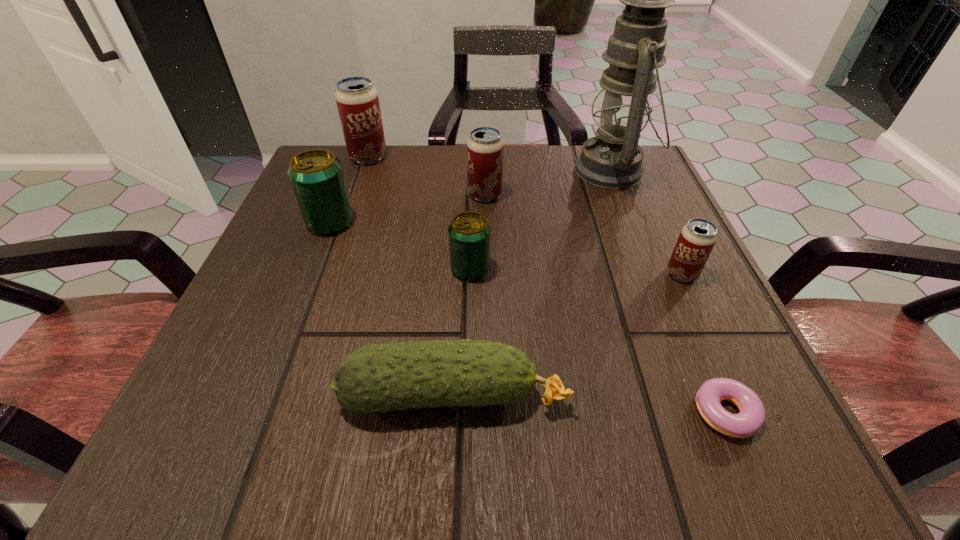
I want to click on oil lamp, so click(x=613, y=159).

Identify the location of the seventh shortest object. The width and height of the screenshot is (960, 540). (357, 100).

The image size is (960, 540). I want to click on the leftmost red beer can, so click(x=357, y=100).

The width and height of the screenshot is (960, 540). In order to click on the second farthest red beer can in this screenshot , I will do `click(485, 146)`.

You are a GUI agent. You are given a task and a screenshot of the screen. Output one action in this format:
    pyautogui.click(x=<x>, y=<y>)
    Task: Click on the fourth nearest beer can
    
    Given the screenshot: What is the action you would take?
    pyautogui.click(x=485, y=146)

Where is `the third nearest beer can`? the third nearest beer can is located at coordinates (316, 175).

Identify the location of the bigger green beer can. This screenshot has height=540, width=960. (316, 175).

Where is `the nearest red beer can`? The image size is (960, 540). the nearest red beer can is located at coordinates (697, 238).

You are a GUI agent. You are given a task and a screenshot of the screen. Output one action in this format:
    pyautogui.click(x=<x>, y=<y>)
    Task: Click on the smallest red beer can
    
    Given the screenshot: What is the action you would take?
    point(697,238)

You are a GUI agent. You are given a task and a screenshot of the screen. Output one action in this format:
    pyautogui.click(x=<x>, y=<y>)
    Task: Click on the right green beer can
    
    Given the screenshot: What is the action you would take?
    pyautogui.click(x=469, y=232)